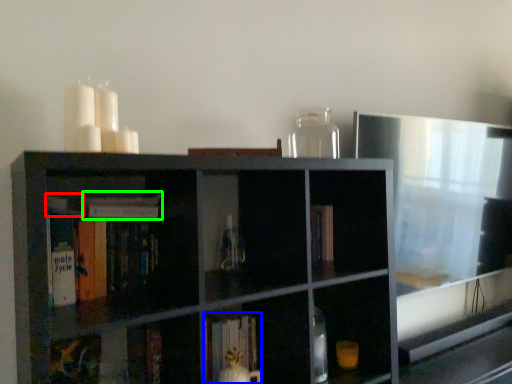
Question: Considering the real-world distances, which object is farthest from book (highlighted by a red box)? book (highlighted by a blue box) or book (highlighted by a green box)?

Choices:
 (A) book
 (B) book

Answer: (A)